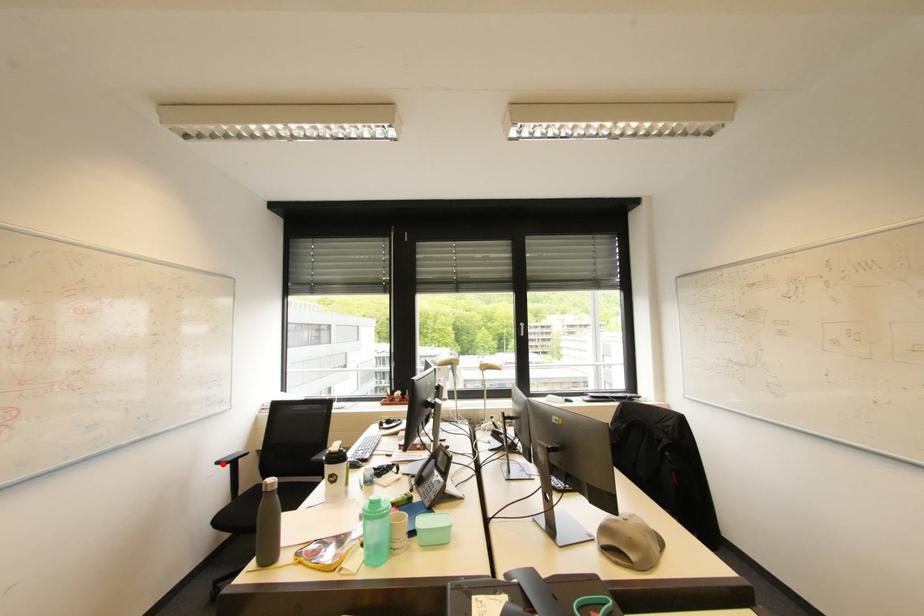
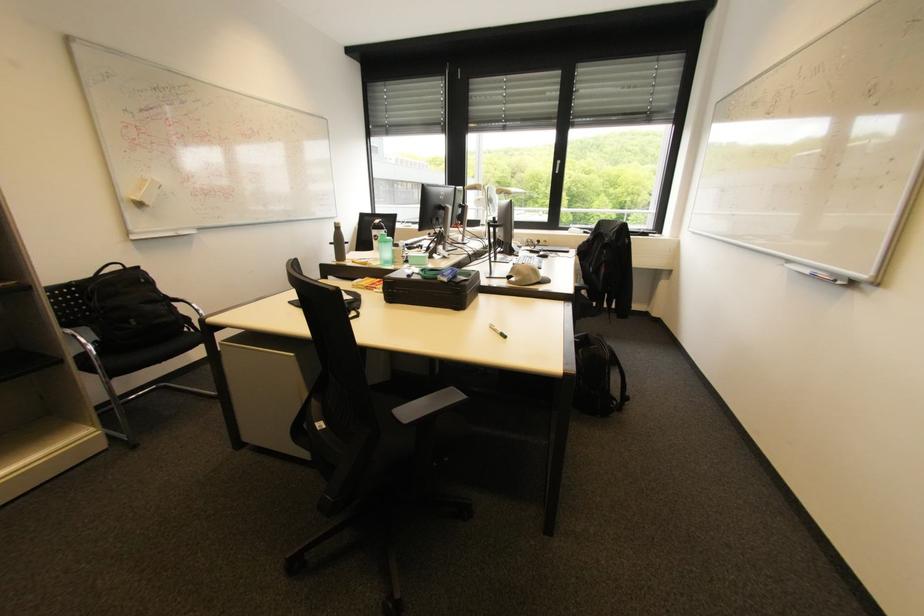
Find the pixel in the second image that matches the highlighted location in the first image.

(335, 244)